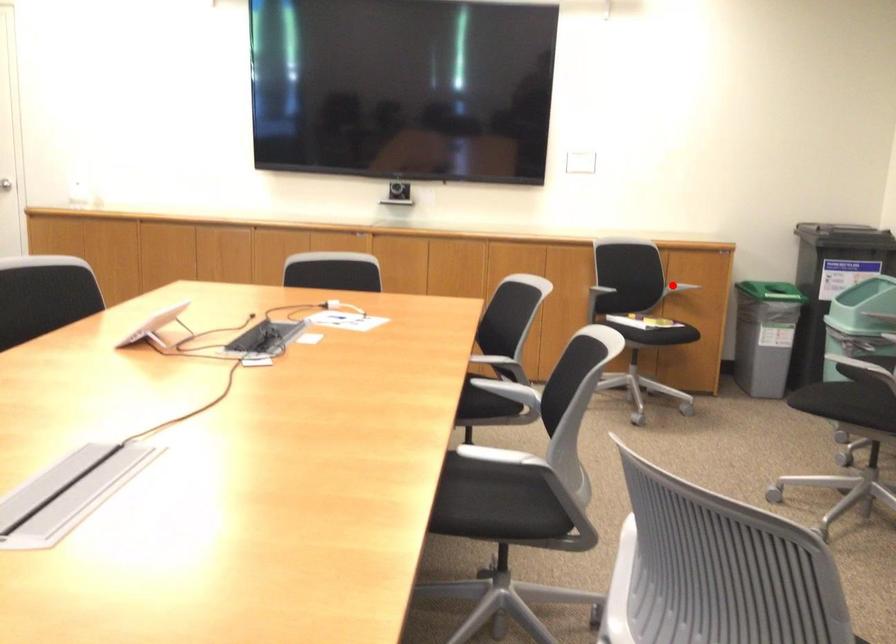
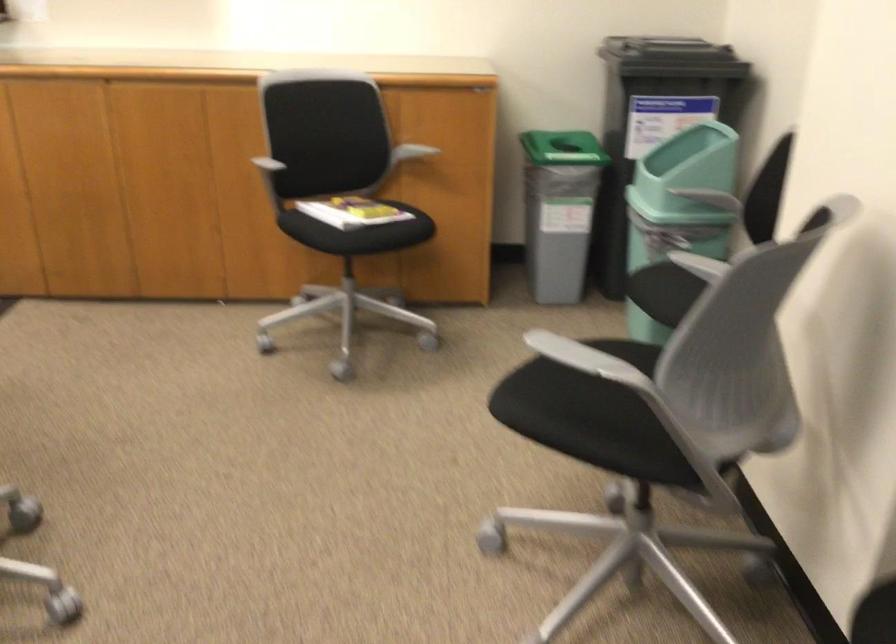
Question: I am providing you with two images of the same scene from different viewpoints. A red point is marked on the first image. At the location where the point appears in image 1, is it still visible in image 2?

Choices:
 (A) Yes
 (B) No

Answer: (B)